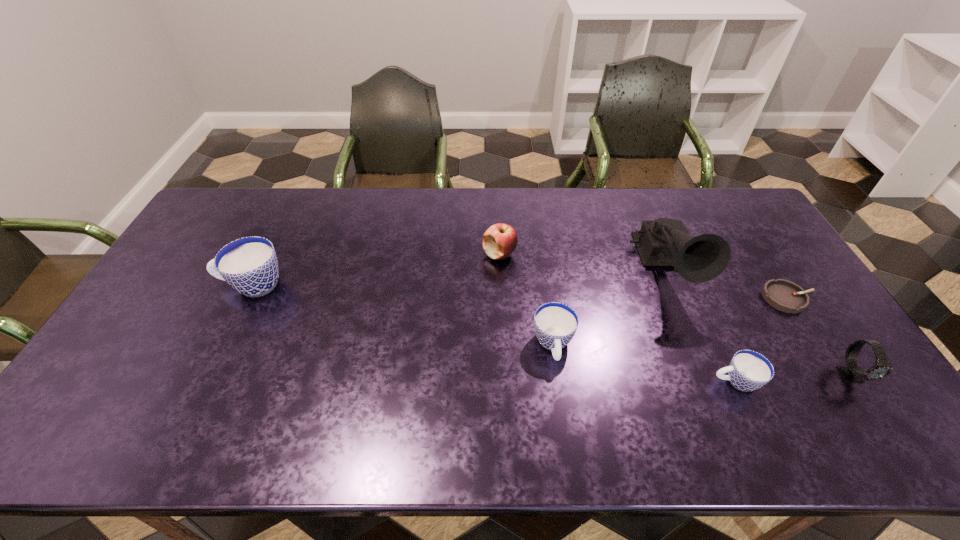
Locate an element on the screen. free region at the far right corner of the desktop is located at coordinates (700, 197).

Locate an element on the screen. The height and width of the screenshot is (540, 960). free space between the sixth object from right to left and the watch is located at coordinates (676, 314).

Image resolution: width=960 pixels, height=540 pixels. Identify the location of vacant area that lies between the watch and the fifth tallest object. (x=702, y=360).

You are a GUI agent. You are given a task and a screenshot of the screen. Output one action in this format:
    pyautogui.click(x=<x>, y=<y>)
    Task: Click on the vacant area between the fifth object from right to left and the shortest cup
    This screenshot has height=540, width=960.
    Given the screenshot: What is the action you would take?
    pyautogui.click(x=644, y=363)

The image size is (960, 540). I want to click on free space between the second tallest cup and the tallest object, so click(x=610, y=307).

I want to click on vacant point located between the shortest cup and the shortest object, so click(x=761, y=340).

Where is `vacant area that lies between the watch and the ashtray`? The image size is (960, 540). vacant area that lies between the watch and the ashtray is located at coordinates (819, 336).

At what (x,y) coordinates should I click in order to perform the action: click on free space between the farthest cup and the apple. Please return your answer as a coordinate pair (x, y). The width and height of the screenshot is (960, 540). Looking at the image, I should click on (375, 269).

This screenshot has height=540, width=960. What are the coordinates of `vacant space in between the rightmost cup and the third shortest object` in the screenshot? It's located at (644, 363).

In order to click on vacant space in between the watch and the second cup from right to left in this screenshot , I will do `click(702, 360)`.